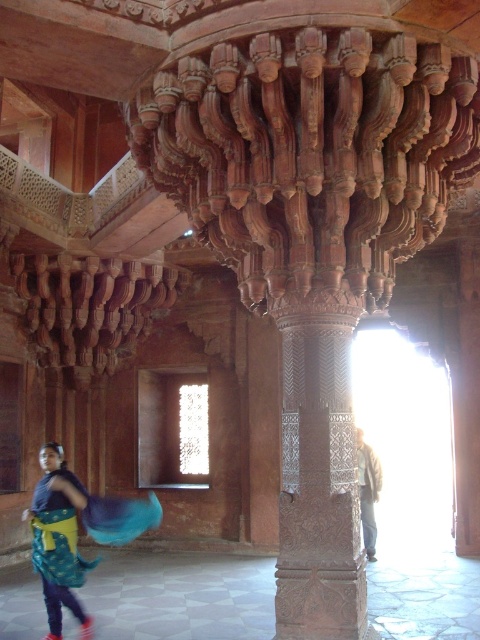
Question: Can you confirm if brown carved column at center is positioned to the left of light brown leather jacket at right?

Choices:
 (A) no
 (B) yes

Answer: (B)

Question: Which point is farther to the camera?

Choices:
 (A) (365, 513)
 (B) (330, 291)
 (C) (50, 570)

Answer: (A)

Question: Which of the following is the farthest from the observer?

Choices:
 (A) brown carved column at center
 (B) light brown leather jacket at right
 (C) teal fabric skirt at lower left

Answer: (B)

Question: Is brown carved column at center closer to camera compared to teal fabric skirt at lower left?

Choices:
 (A) no
 (B) yes

Answer: (B)

Question: Which point is closer to the camera taking this photo?

Choices:
 (A) (373, 488)
 (B) (336, 525)

Answer: (B)

Question: Can you confirm if teal fabric skirt at lower left is bigger than light brown leather jacket at right?

Choices:
 (A) no
 (B) yes

Answer: (B)